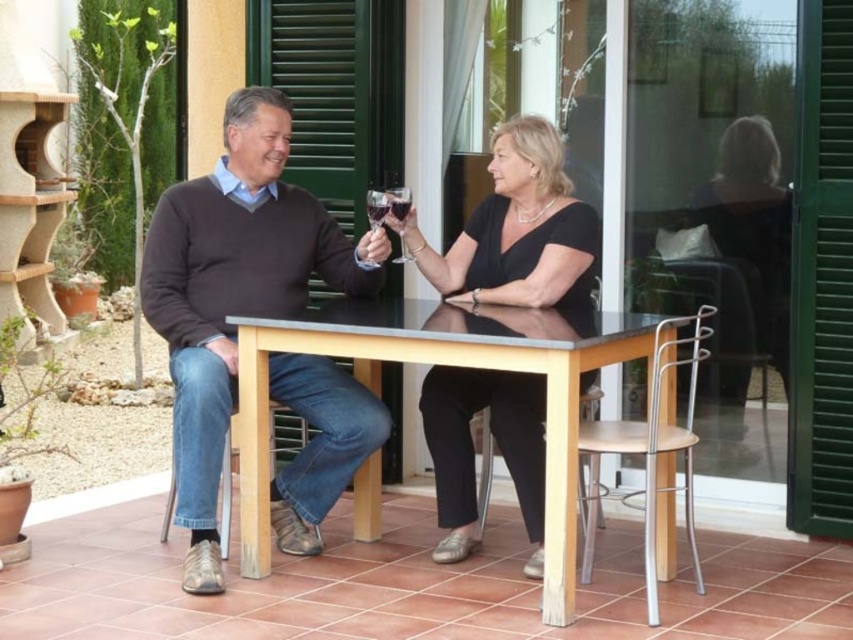
You are standing at the point labeled point (206, 582) and want to walk to the point labeled point (393, 196). Which direction should you face to walk directly towards your destination?

You should face backward because point (206, 582) is in front of point (393, 196), so to reach point (393, 196) you need to move in the opposite direction.

You are a photographer taking a picture of the scene. The brown sweater at left and the clear glass wine glass at center are both in your viewfinder. Which object will appear closer to the camera in the photo?

The brown sweater at left will appear closer to the camera because it is in front of the clear glass wine glass at center.